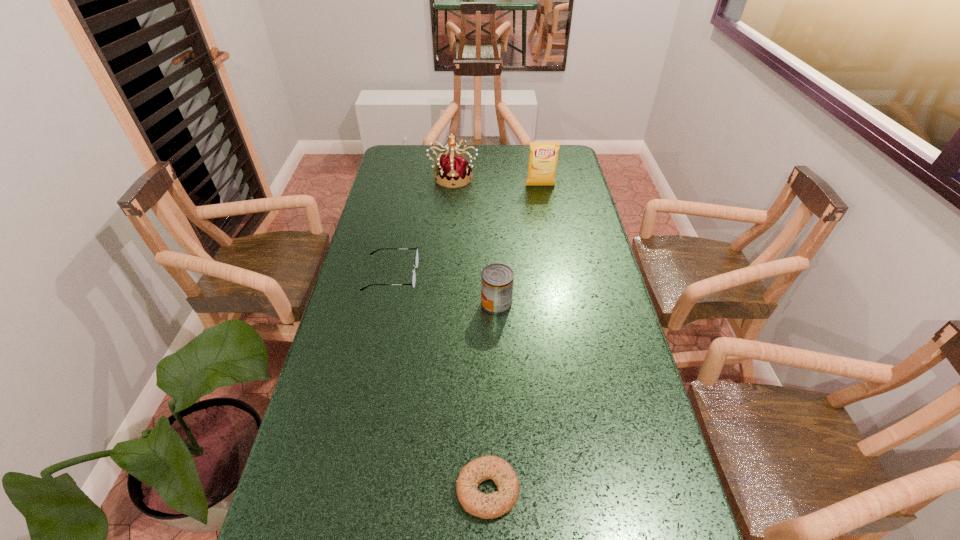
Identify the location of vacant area between the second shortest object and the can. The width and height of the screenshot is (960, 540). (444, 289).

The image size is (960, 540). Find the location of `empty space that is in between the second shortest object and the crisp (potato chip)`. empty space that is in between the second shortest object and the crisp (potato chip) is located at coordinates (466, 231).

You are a GUI agent. You are given a task and a screenshot of the screen. Output one action in this format:
    pyautogui.click(x=<x>, y=<y>)
    Task: Click on the unoccupied area between the nearest object and the fourth tallest object
    The width and height of the screenshot is (960, 540).
    Given the screenshot: What is the action you would take?
    pyautogui.click(x=440, y=382)

You are a GUI agent. You are given a task and a screenshot of the screen. Output one action in this format:
    pyautogui.click(x=<x>, y=<y>)
    Task: Click on the free spot between the second shortest object and the can
    
    Given the screenshot: What is the action you would take?
    click(444, 289)

Where is `blank region between the crisp (potato chip) and the nearest object`? blank region between the crisp (potato chip) and the nearest object is located at coordinates (514, 338).

Locate which object ranks third in proximity to the crisp (potato chip). Please provide its 2D coordinates. Your answer should be formatted as a tuple, i.e. [(x, y)], where the tuple contains the x and y coordinates of a point satisfying the conditions above.

[(497, 280)]

Identify which object is the second nearest to the spectacles. Please provide its 2D coordinates. Your answer should be formatted as a tuple, i.e. [(x, y)], where the tuple contains the x and y coordinates of a point satisfying the conditions above.

[(454, 169)]

Where is `vacant position in the image that satisfies the following two spatial constraints: 1. on the front-facing side of the tiara; 2. on the right side of the third shortest object`? The image size is (960, 540). vacant position in the image that satisfies the following two spatial constraints: 1. on the front-facing side of the tiara; 2. on the right side of the third shortest object is located at coordinates (444, 303).

Image resolution: width=960 pixels, height=540 pixels. Identify the location of blank area in the image that satisfies the following two spatial constraints: 1. on the front-facing side of the tiara; 2. on the left side of the nearest object. (428, 489).

Image resolution: width=960 pixels, height=540 pixels. In order to click on free location that satisfies the following two spatial constraints: 1. on the lenses of the fourth tallest object; 2. on the right side of the can in this screenshot , I will do point(386,303).